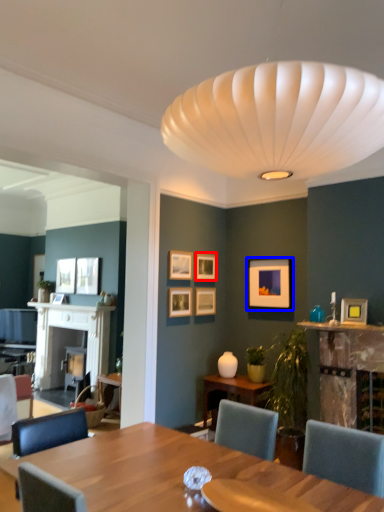
Question: Which of the following is the closest to the observer, picture frame (highlighted by a red box) or picture frame (highlighted by a blue box)?

Choices:
 (A) picture frame
 (B) picture frame

Answer: (B)